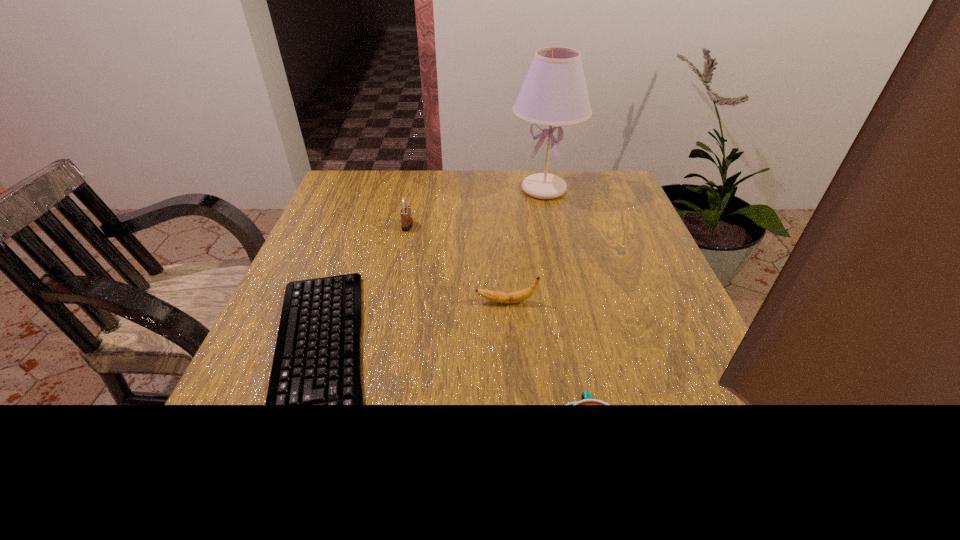
Locate an element on the screen. The image size is (960, 540). empty space between the cappuccino and the second farthest object is located at coordinates (498, 337).

The width and height of the screenshot is (960, 540). Identify the location of vacant area that lies between the fourth nearest object and the cappuccino. (498, 337).

You are a GUI agent. You are given a task and a screenshot of the screen. Output one action in this format:
    pyautogui.click(x=<x>, y=<y>)
    Task: Click on the empty space that is in between the second tallest object and the farthest object
    Image resolution: width=960 pixels, height=540 pixels.
    Given the screenshot: What is the action you would take?
    pyautogui.click(x=475, y=207)

Find the location of a particular element. Image resolution: width=960 pixels, height=540 pixels. empty location between the cappuccino and the second farthest object is located at coordinates coord(498,337).

Image resolution: width=960 pixels, height=540 pixels. Find the location of `vacant region between the shortest object and the banana`. vacant region between the shortest object and the banana is located at coordinates (413, 336).

Locate an element on the screen. vacant space that is in between the padlock and the shortest object is located at coordinates 363,298.

You are a GUI agent. You are given a task and a screenshot of the screen. Output one action in this format:
    pyautogui.click(x=<x>, y=<y>)
    Task: Click on the vacant area that lies between the banana and the tallest object
    
    Given the screenshot: What is the action you would take?
    pyautogui.click(x=525, y=246)

At what (x,y) coordinates should I click in order to perform the action: click on vacant point located between the cappuccino and the shortest object. Please return your answer as a coordinate pair (x, y). Image resolution: width=960 pixels, height=540 pixels. Looking at the image, I should click on (453, 409).

This screenshot has width=960, height=540. In order to click on the fourth closest object to the computer keyboard in this screenshot , I will do `click(554, 92)`.

Locate which object is the closest to the shortest object. Please provide its 2D coordinates. Your answer should be formatted as a tuple, i.e. [(x, y)], where the tuple contains the x and y coordinates of a point satisfying the conditions above.

[(517, 296)]